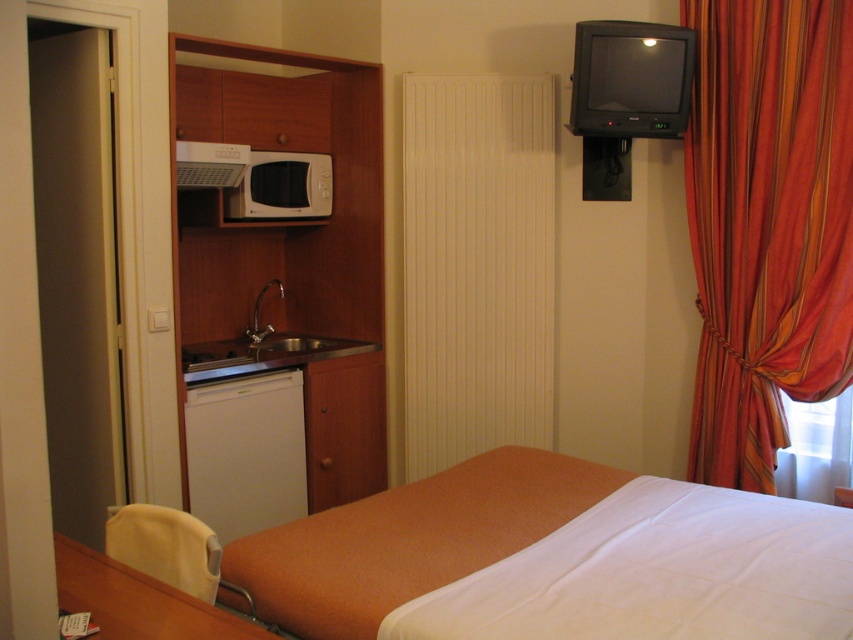
Question: Is the position of stainless steel sink at center less distant than that of white glossy microwave at upper left?

Choices:
 (A) yes
 (B) no

Answer: (A)

Question: Which object appears closest to the camera in this image?

Choices:
 (A) white matte microwave at upper left
 (B) white glossy microwave at upper left
 (C) orange fabric bed at center
 (D) white matte dishwasher at lower left

Answer: (C)

Question: Which of the following is the closest to the observer?

Choices:
 (A) stainless steel sink at center
 (B) white matte dishwasher at lower left

Answer: (B)

Question: Is orange striped fabric at right wider than white matte microwave at upper left?

Choices:
 (A) yes
 (B) no

Answer: (A)

Question: Which of these objects is positioned closest to the orange fabric bed at center?

Choices:
 (A) stainless steel sink at center
 (B) white matte microwave at upper left
 (C) white glossy microwave at upper left

Answer: (A)

Question: Does orange striped fabric at right come behind stainless steel sink at center?

Choices:
 (A) yes
 (B) no

Answer: (B)